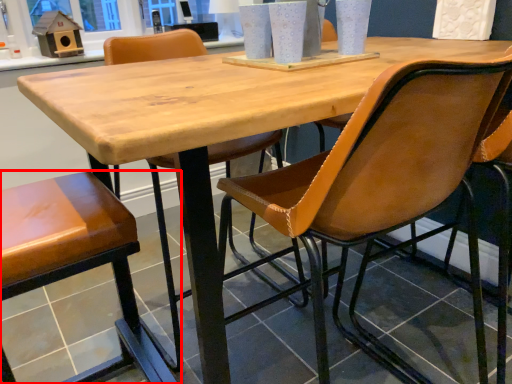
Question: From the image, what is the correct spatial relationship of chair (annotated by the red box) in relation to chair?

Choices:
 (A) right
 (B) left

Answer: (B)